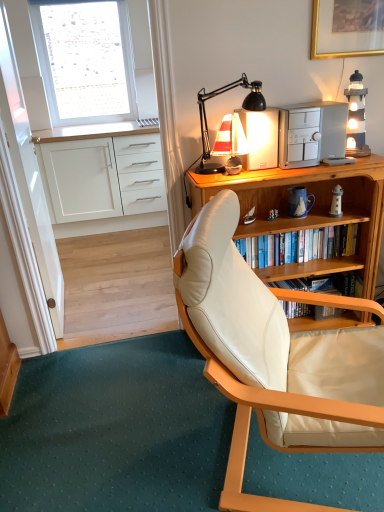
In order to click on free area behind white plastic phone at upper right in this screenshot , I will do `click(350, 157)`.